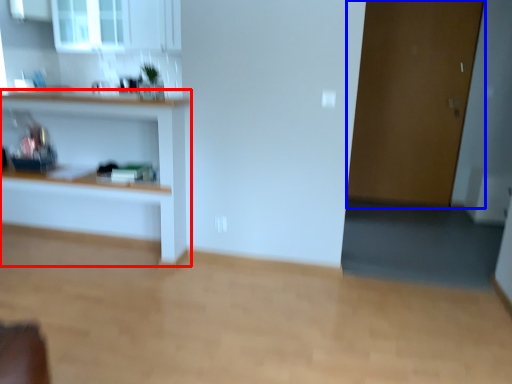
Question: Which object is further to the camera taking this photo, shelf (highlighted by a red box) or door (highlighted by a blue box)?

Choices:
 (A) shelf
 (B) door

Answer: (B)